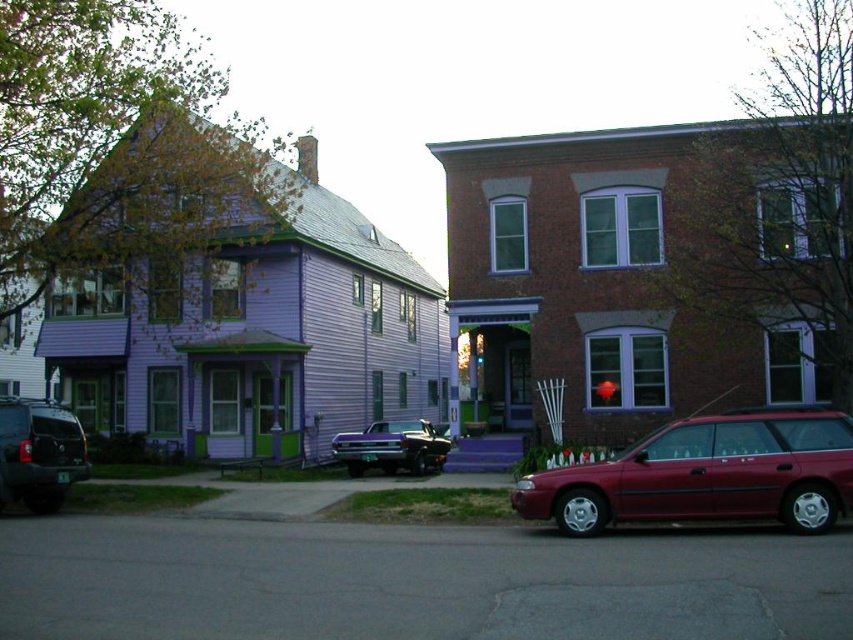
You are standing at the center of the residential street and want to walk to the house on the left. Is the matte black SUV at lower left blocking your path? Please explain based on its position.

The matte black suv at lower left is located at point (39,452), which places it near the lower left corner of the image. Since the house is on the left side of the street and the SUV is parked in front of it, the SUV is likely blocking the direct path to the house. However, the coordinates suggest it might be positioned closer to the edge of the scene, so there could be space around it to navigate around.

You are a delivery driver who needs to park your vehicle between the matte black suv at lower left and the shiny purple car at center. Is there enough space for your van, which is 2 meters wide, between them?

The matte black suv at lower left is positioned on the left side of shiny purple car at center. Since the distance between them isn not specified, but the vehicles are placed next to each other, it might be tight. However, without exact measurements, we can assume the space is standard. If the gap is at least 2 meters, the van can fit. But since the description only states their positions, we cannot confirm. Please check the actual space.